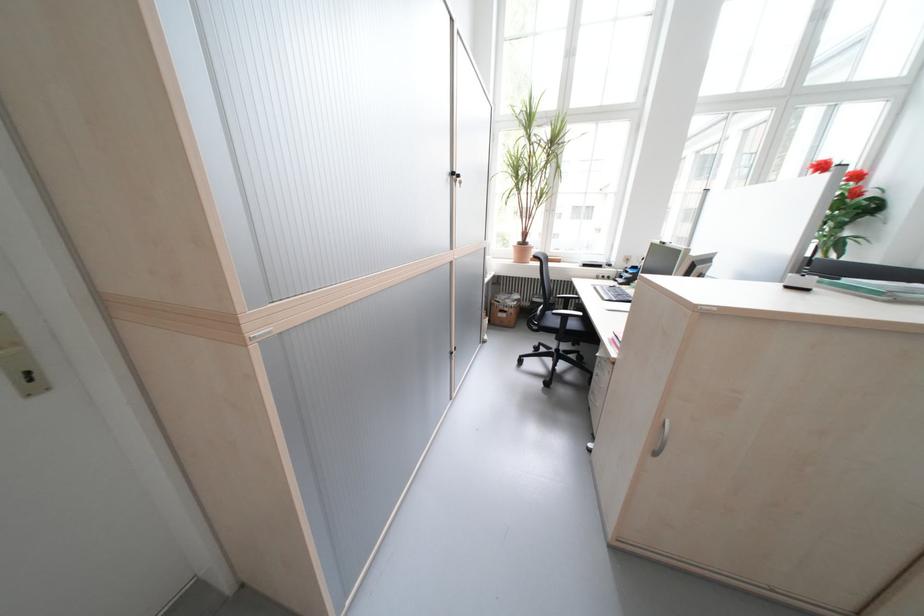
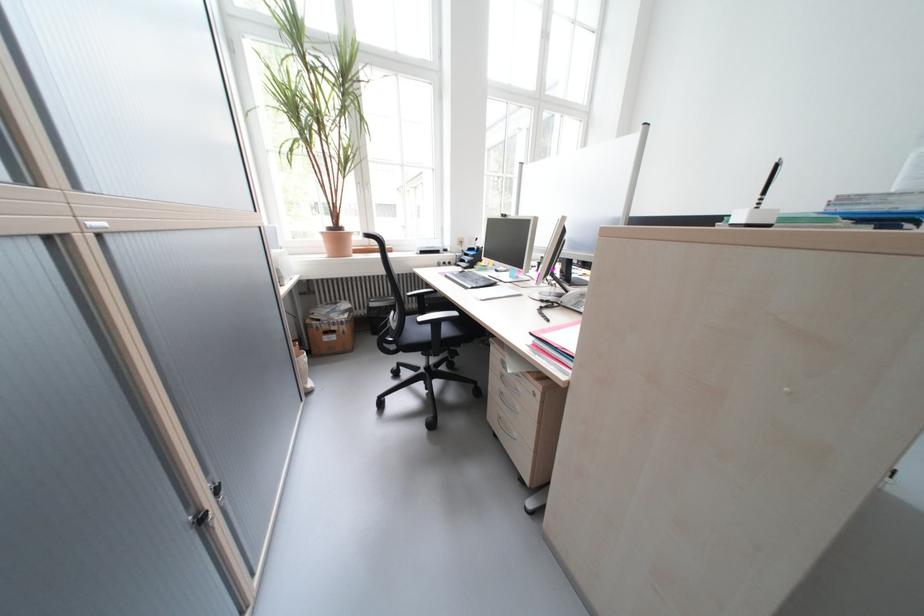
Find the pixel in the second image that matches pixel 515 315 in the first image.

(344, 339)